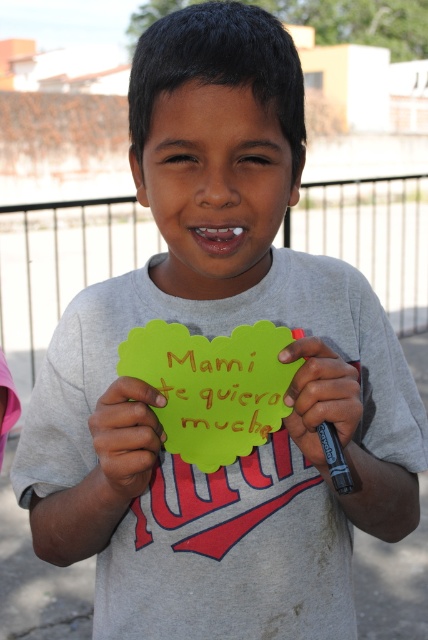
Question: Can you confirm if smooth yellow paper at center is positioned above matte green paper at center?

Choices:
 (A) yes
 (B) no

Answer: (B)

Question: Which of the following is the farthest from the observer?

Choices:
 (A) yellow paper at center
 (B) smooth yellow paper at center

Answer: (A)

Question: Does yellow paper at center have a greater width compared to matte green paper at center?

Choices:
 (A) no
 (B) yes

Answer: (B)

Question: Which object appears farthest from the camera in this image?

Choices:
 (A) smooth yellow paper at center
 (B) yellow paper at center

Answer: (B)

Question: Can you confirm if smooth yellow paper at center is positioned to the right of matte green paper at center?

Choices:
 (A) no
 (B) yes

Answer: (A)

Question: Which point appears farthest from the camera in this image?

Choices:
 (A) (133, 474)
 (B) (309, 429)

Answer: (B)